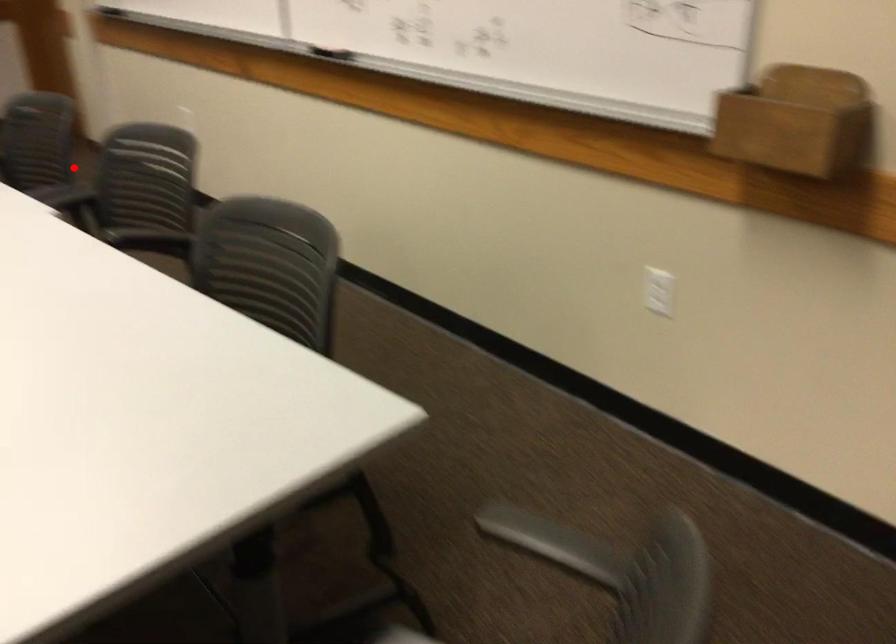
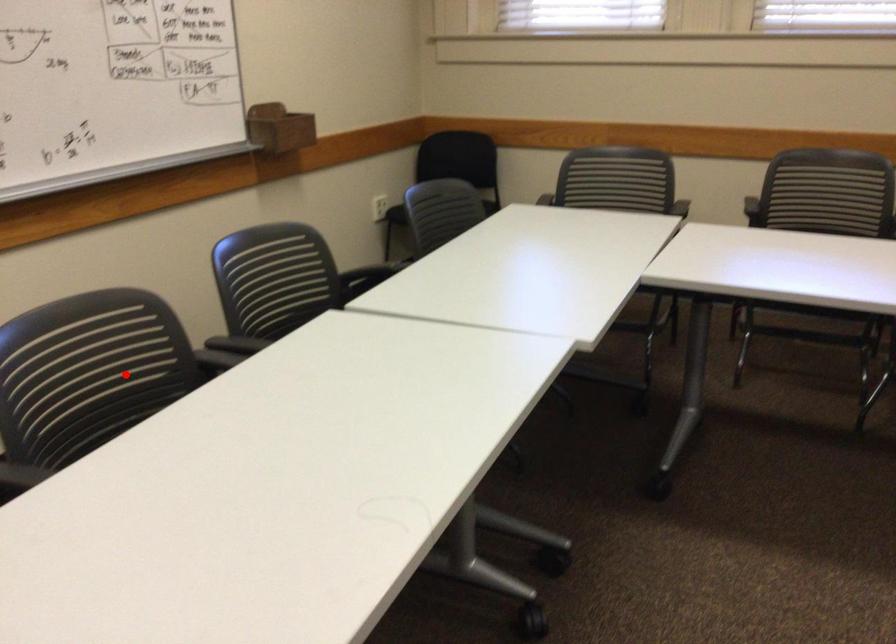
I am providing you with two images of the same scene from different viewpoints. A red point is marked on the first image and another point is marked on the second image. Do the highlighted points in image1 and image2 indicate the same real-world spot?

Yes